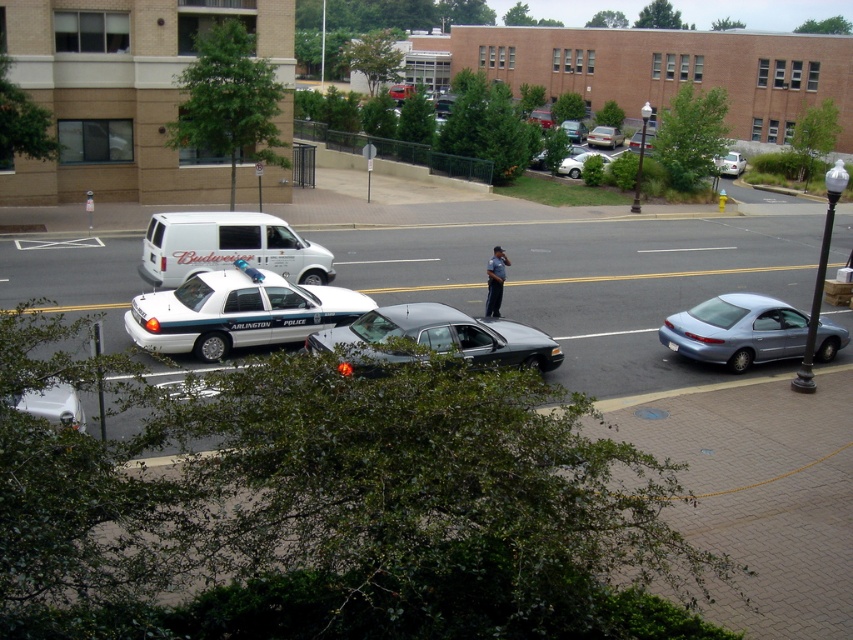
Question: Can you confirm if shiny black sedan at center is positioned to the right of metallic silver sedan at center?

Choices:
 (A) yes
 (B) no

Answer: (B)

Question: Can you confirm if shiny black sedan at center is bigger than white matte sedan at upper right?

Choices:
 (A) yes
 (B) no

Answer: (B)

Question: Can you confirm if silver metallic sedan at center is positioned below metallic silver sedan at center?

Choices:
 (A) yes
 (B) no

Answer: (B)

Question: Which of the following is the closest to the observer?

Choices:
 (A) (608, 134)
 (B) (245, 232)
 (C) (695, 326)

Answer: (C)

Question: Among these objects, which one is farthest from the camera?

Choices:
 (A) dark blue uniform at center
 (B) metallic silver sedan at center
 (C) metallic blue sedan at right
 (D) white matte van at left

Answer: (B)

Question: Which point is farther to the camera?

Choices:
 (A) (729, 170)
 (B) (323, 266)
 (C) (352, 230)

Answer: (A)